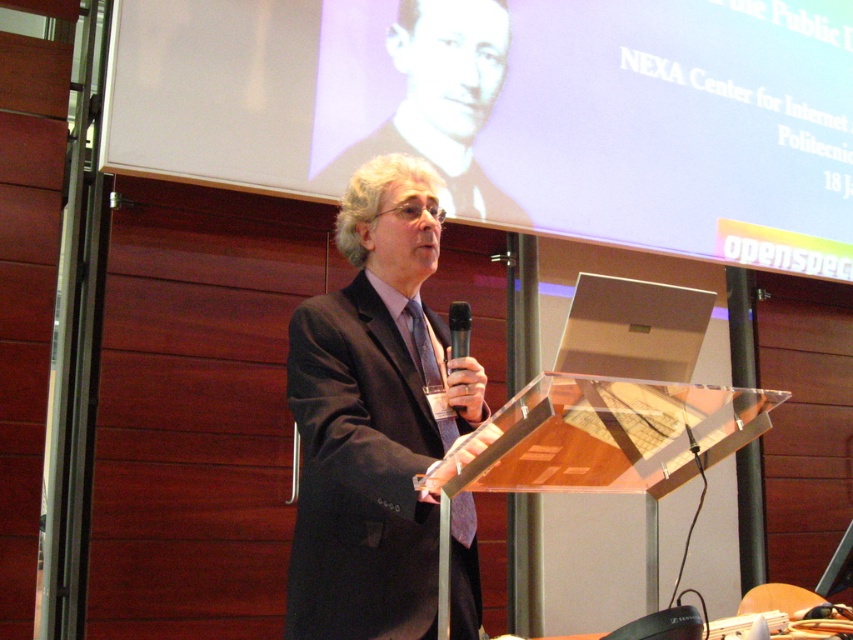
Identify the location of white matte projection screen at upper center. (515, 112).

Who is more forward, (328, 170) or (439, 416)?

Point (439, 416) is more forward.

You are a GUI agent. You are given a task and a screenshot of the screen. Output one action in this format:
    pyautogui.click(x=<x>, y=<y>)
    Task: Click on the white matte projection screen at upper center
    Image resolution: width=853 pixels, height=640 pixels.
    Given the screenshot: What is the action you would take?
    pyautogui.click(x=515, y=112)

Between transparent acrylic podium at center and black plastic microphone at center, which one has more height?

Standing taller between the two is transparent acrylic podium at center.

Does transparent acrylic podium at center have a greater height compared to black plastic microphone at center?

Yes, transparent acrylic podium at center is taller than black plastic microphone at center.

Is point (759, 422) more distant than point (463, 348)?

No, it is in front of (463, 348).

Where is `transparent acrylic podium at center`? The image size is (853, 640). transparent acrylic podium at center is located at coordinates (595, 444).

Is dark suit at center positioned in front of black plastic microphone at center?

Yes, it is in front of black plastic microphone at center.

Is point (366, 426) closer to camera compared to point (469, 317)?

Yes, it is.

You are a GUI agent. You are given a task and a screenshot of the screen. Output one action in this format:
    pyautogui.click(x=<x>, y=<y>)
    Task: Click on the dark suit at center
    The image size is (853, 640).
    Given the screenshot: What is the action you would take?
    pyautogui.click(x=374, y=417)